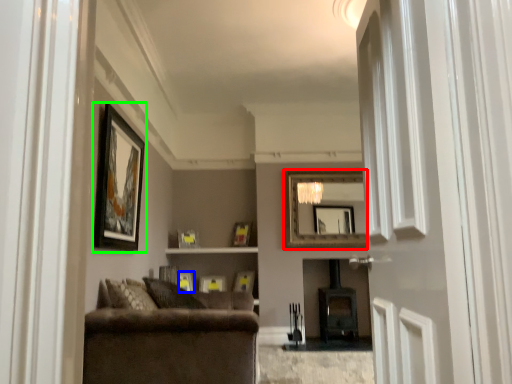
Question: Which is farther away from mirror (highlighted by a red box)? picture frame (highlighted by a blue box) or picture frame (highlighted by a green box)?

Choices:
 (A) picture frame
 (B) picture frame

Answer: (B)